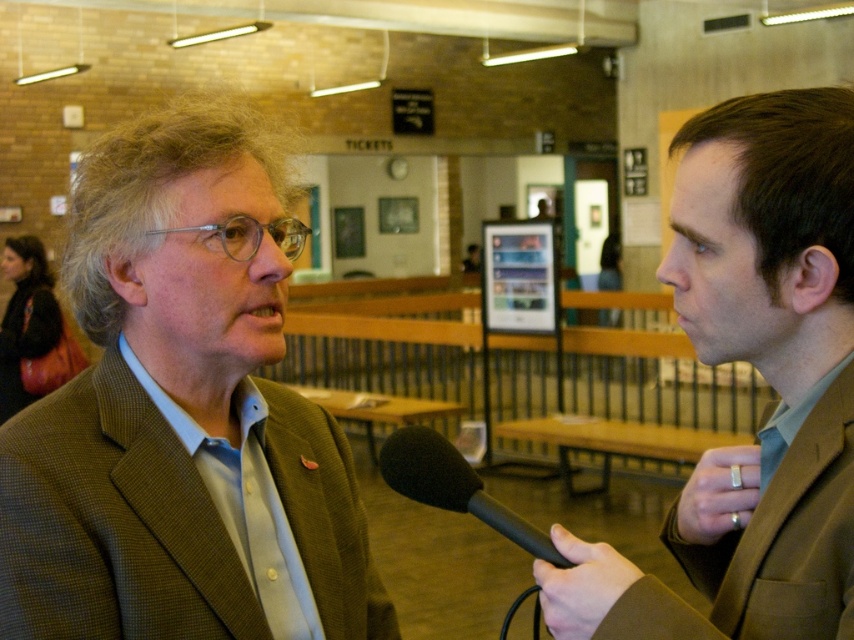
You are standing in the exhibition hall and want to find the brown suit at right. Based on the coordinates provided, can you determine its position relative to the center of the room?

The brown suit at right is located at coordinates 0.586 on the x axis and 0.892 on the y axis, which places it to the right and slightly above the center of the room.

You are a photographer standing at the camera position. You need to take a photo of the two people talking. The focus point of your camera is set to point (179,365). Will the two people be in focus?

The distance between the focus point and the camera is 1.14 meters. Since both people are positioned at this focus distance, they will be in focus.